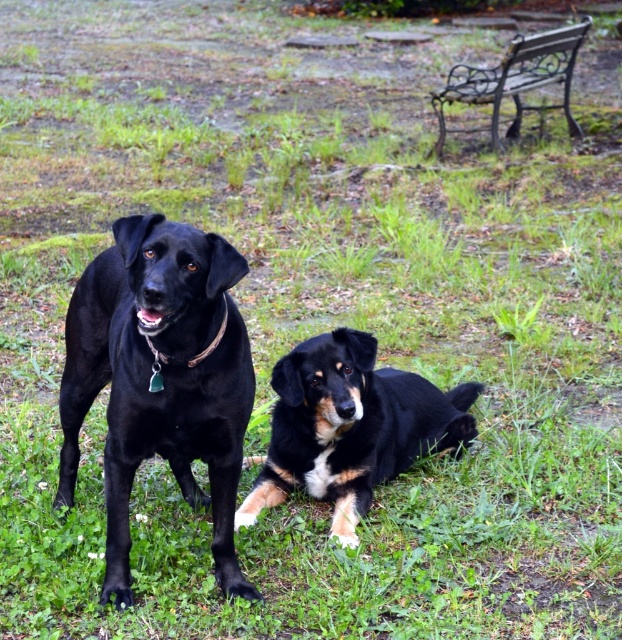
You are standing in a park and see the matte black dog at left and the metallic wrought iron bench at upper right. Which object is closer to your left side?

The matte black dog at left is closer to your left side because it is positioned to the left of the metallic wrought iron bench at upper right.

You are a photographer trying to capture a closeup of the dog with the green collar tag. You have a camera with a zoom lens that can focus precisely on a specific point. The point you selected is at coordinates point [159,378]. Based on the scene description, will this point be on the correct dog?

The point [159,378] is on the matte black dog at left, so yes, this point is on the correct dog because the matte black dog at left has the green collar tag.